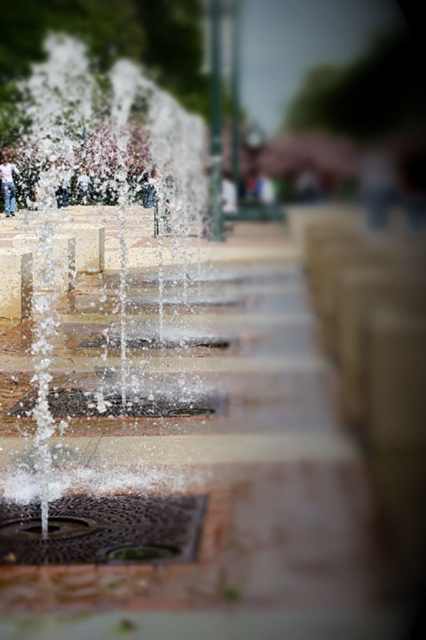
Does denim jeans at left appear on the left side of light blue jeans at center?

Correct, you'll find denim jeans at left to the left of light blue jeans at center.

Is point (17, 173) in front of point (80, 179)?

Yes.

The height and width of the screenshot is (640, 426). I want to click on denim jeans at left, so click(8, 184).

Between clear water jets at center and denim jeans at left, which one is positioned lower?

clear water jets at center

Does clear water jets at center have a larger size compared to denim jeans at left?

Yes, clear water jets at center is bigger than denim jeans at left.

Image resolution: width=426 pixels, height=640 pixels. Identify the location of clear water jets at center. click(109, 333).

Who is shorter, clear water jets at center or light blue jeans at center?

With less height is light blue jeans at center.

Is point (57, 502) behind point (78, 179)?

No, it is not.

Locate an element on the screen. The width and height of the screenshot is (426, 640). clear water jets at center is located at coordinates (109, 333).